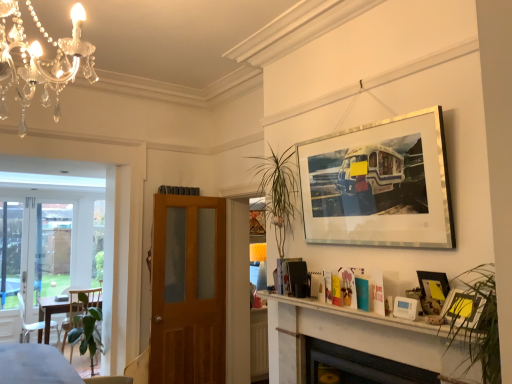
Question: From the image's perspective, is green glossy plant at lower left located above or below black glass fireplace at lower center?

Choices:
 (A) below
 (B) above

Answer: (A)

Question: Is green glossy plant at lower left taller or shorter than black glass fireplace at lower center?

Choices:
 (A) tall
 (B) short

Answer: (A)

Question: Which object is the farthest from the matte yellow picture frame at lower right, the 3th picture frame positioned from the bottom?

Choices:
 (A) wooden door at center
 (B) metallic silver picture frame at upper right, positioned as the 3th picture frame in top-to-bottom order
 (C) white plastic thermostat at lower right, which is the 1th picture frame from bottom to top
 (D) green glossy plant at lower left
 (E) black glass fireplace at lower center

Answer: (D)

Question: Estimate the real-world distances between objects in this image. Which object is closer to the silver/metallic picture frame at upper right, which ranks as the fourth picture frame in bottom-to-top order?

Choices:
 (A) green glossy plant at lower left
 (B) white marble fireplace at lower center
 (C) black glass fireplace at lower center
 (D) wooden door at center
 (E) matte yellow picture frame at lower right, the 3th picture frame positioned from the bottom

Answer: (B)